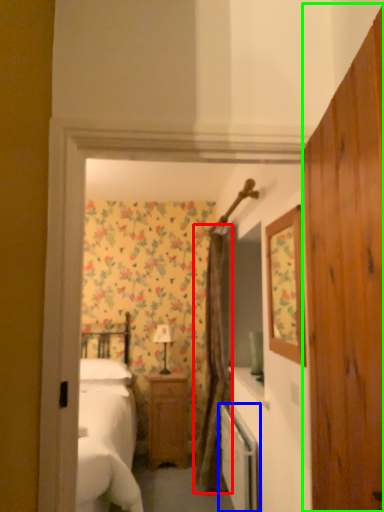
Question: Which object is positioned closest to curtain (highlighted by a red box)? Select from dish washer (highlighted by a blue box) and dresser (highlighted by a green box).

Choices:
 (A) dish washer
 (B) dresser

Answer: (A)